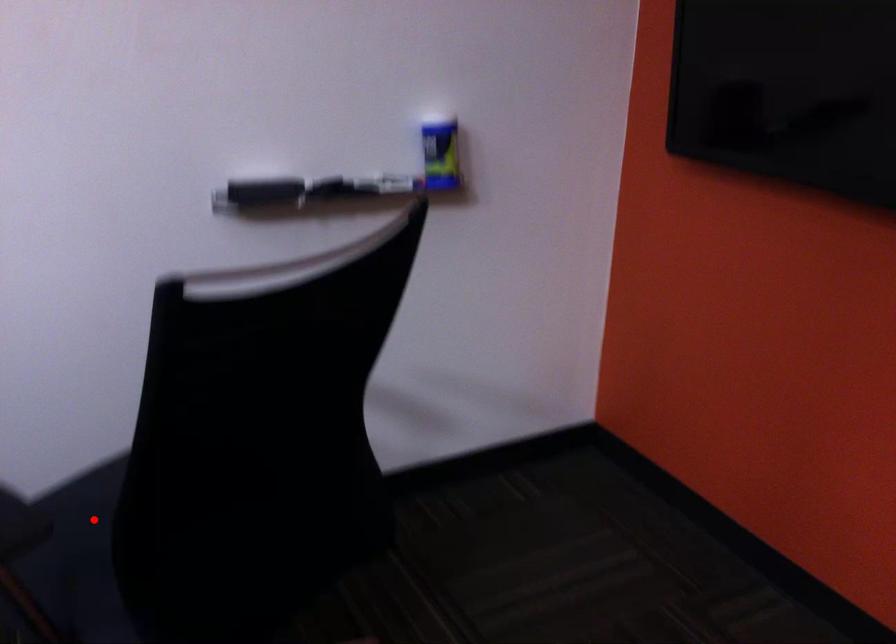
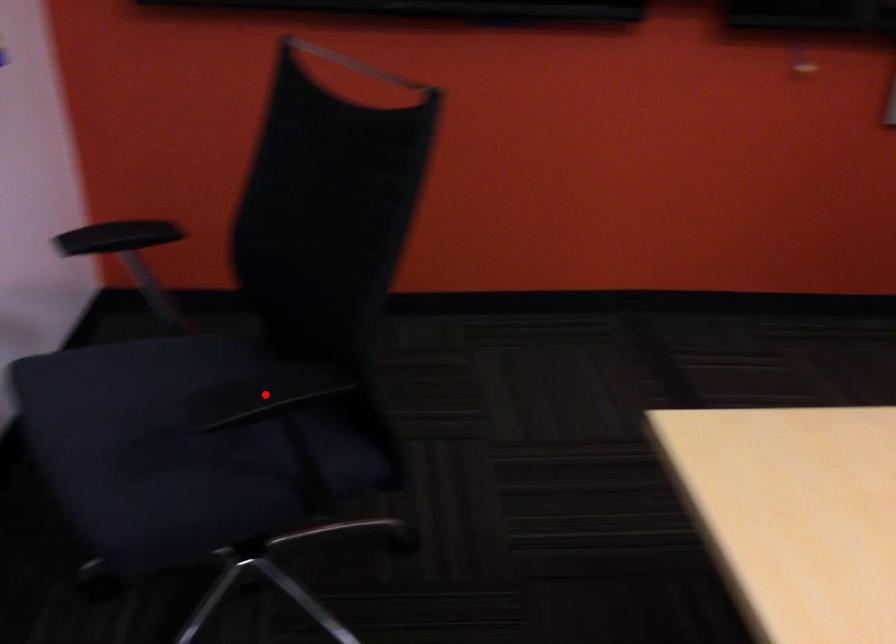
I am providing you with two images of the same scene from different viewpoints. A red point is marked on the first image and another point is marked on the second image. Is the red point in image1 aligned with the point shown in image2?

No